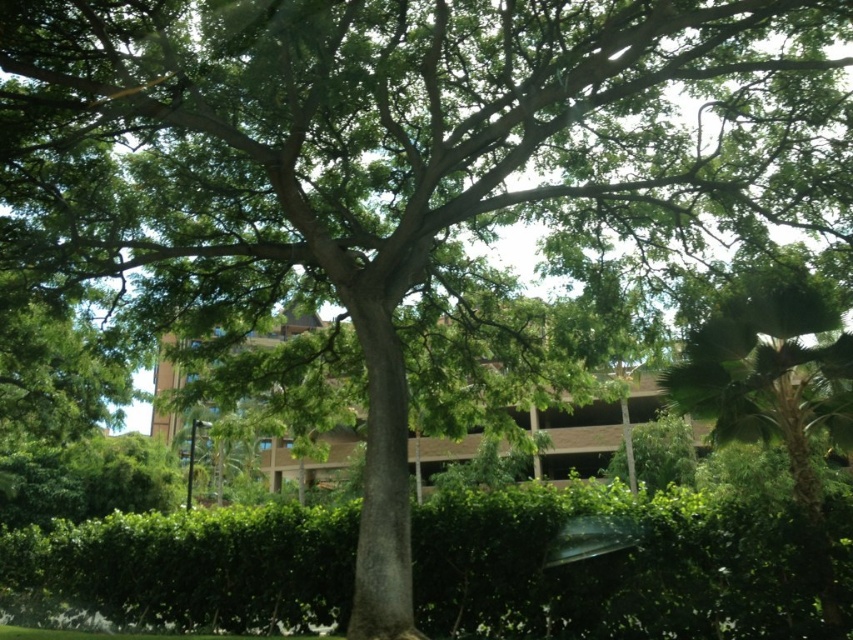
Question: From the image, what is the correct spatial relationship of green leafy hedge at center in relation to green leafy palm at right?

Choices:
 (A) left
 (B) right

Answer: (A)

Question: Which point is farther to the camera?

Choices:
 (A) green leafy hedge at center
 (B) green leafy palm at right

Answer: (B)

Question: Does green leafy hedge at center appear over green leafy palm at right?

Choices:
 (A) yes
 (B) no

Answer: (B)

Question: Is green leafy hedge at center thinner than green leafy palm at right?

Choices:
 (A) no
 (B) yes

Answer: (A)

Question: Which point is farther to the camera?

Choices:
 (A) green leafy hedge at center
 (B) green leafy palm at right

Answer: (B)